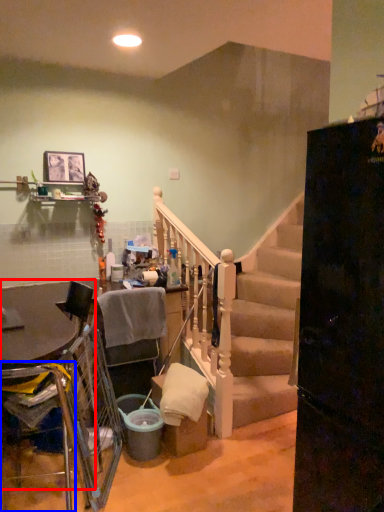
Question: Which of the following is the closest to the observer, table (highlighted by a red box) or armchair (highlighted by a blue box)?

Choices:
 (A) table
 (B) armchair

Answer: (B)